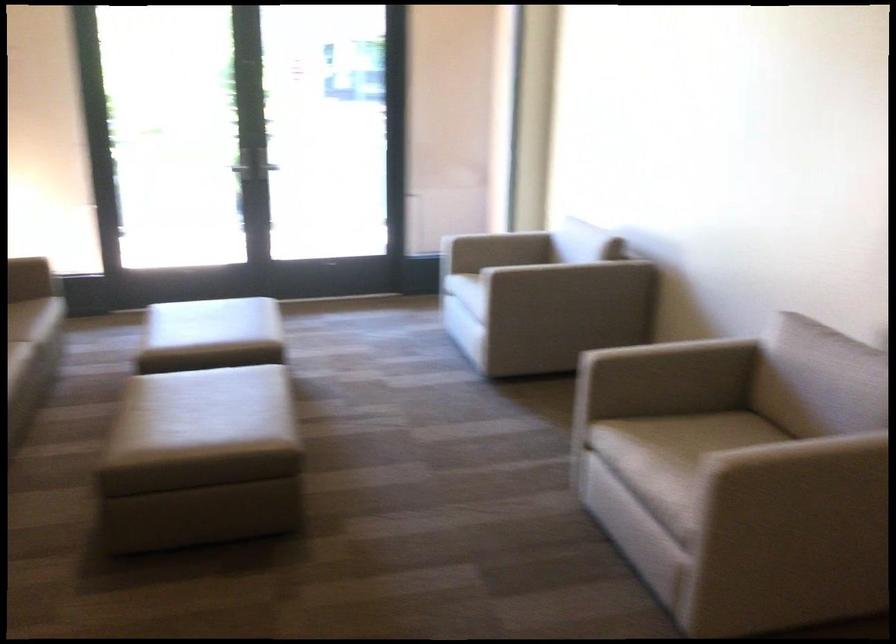
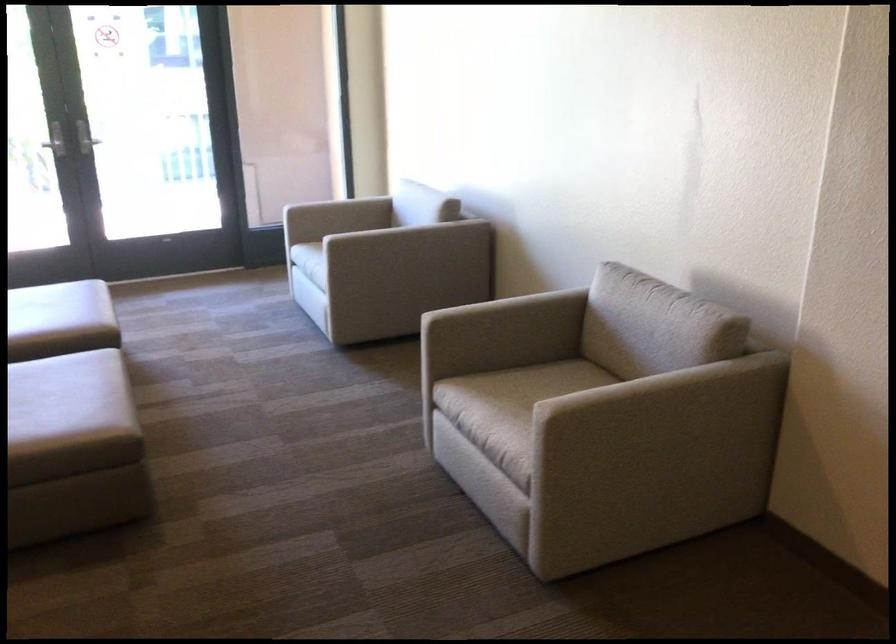
The point at [238,391] is marked in the first image. Where is the corresponding point in the second image?

(65, 384)